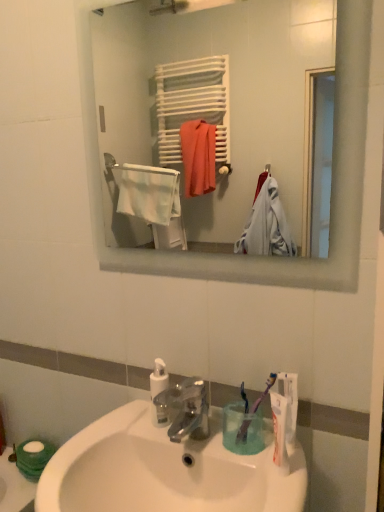
Question: Is satin nickel faucet at center inside white glossy sink at lower center?

Choices:
 (A) yes
 (B) no

Answer: (B)

Question: Is white glossy sink at lower center far away from satin nickel faucet at center?

Choices:
 (A) no
 (B) yes

Answer: (A)

Question: Does white glossy sink at lower center have a lesser height compared to satin nickel faucet at center?

Choices:
 (A) yes
 (B) no

Answer: (B)

Question: From a real-world perspective, is white glossy sink at lower center under satin nickel faucet at center?

Choices:
 (A) yes
 (B) no

Answer: (A)

Question: Is white glossy sink at lower center positioned in front of satin nickel faucet at center?

Choices:
 (A) yes
 (B) no

Answer: (A)

Question: Does white glossy sink at lower center appear on the left side of satin nickel faucet at center?

Choices:
 (A) yes
 (B) no

Answer: (A)

Question: Does white matte toilet paper at lower left have a greater height compared to white matte towel rack at upper center?

Choices:
 (A) yes
 (B) no

Answer: (B)

Question: Does white matte toilet paper at lower left have a lesser height compared to white matte towel rack at upper center?

Choices:
 (A) no
 (B) yes

Answer: (B)

Question: Is white matte toilet paper at lower left at the left side of white matte towel rack at upper center?

Choices:
 (A) no
 (B) yes

Answer: (B)

Question: Can we say white matte toilet paper at lower left lies outside white matte towel rack at upper center?

Choices:
 (A) yes
 (B) no

Answer: (A)

Question: From the image's perspective, is white matte toilet paper at lower left beneath white matte towel rack at upper center?

Choices:
 (A) no
 (B) yes

Answer: (B)

Question: Is white matte toilet paper at lower left bigger than white matte towel rack at upper center?

Choices:
 (A) no
 (B) yes

Answer: (A)

Question: Is white glossy sink at lower center not close to white matte towel rack at upper center?

Choices:
 (A) no
 (B) yes

Answer: (B)